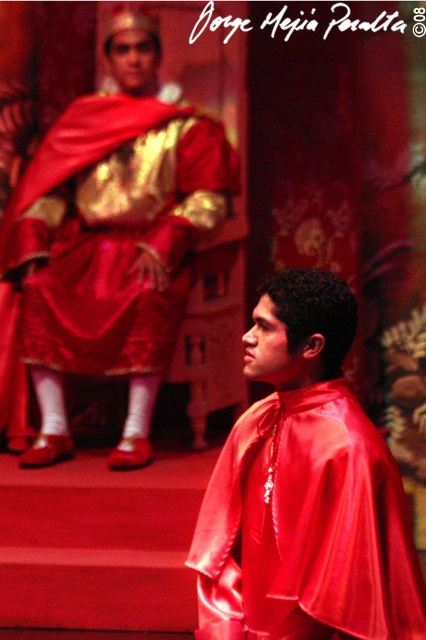
Who is positioned more to the left, satin gold robe at upper left or satin red cape at center?

From the viewer's perspective, satin gold robe at upper left appears more on the left side.

Does point (8, 218) come in front of point (324, 289)?

No, it is not.

Who is more distant from viewer, [62,124] or [265,627]?

Positioned behind is point [62,124].

At what (x,y) coordinates should I click in order to perform the action: click on satin gold robe at upper left. Please return your answer as a coordinate pair (x, y). Image resolution: width=426 pixels, height=640 pixels. Looking at the image, I should click on (112, 237).